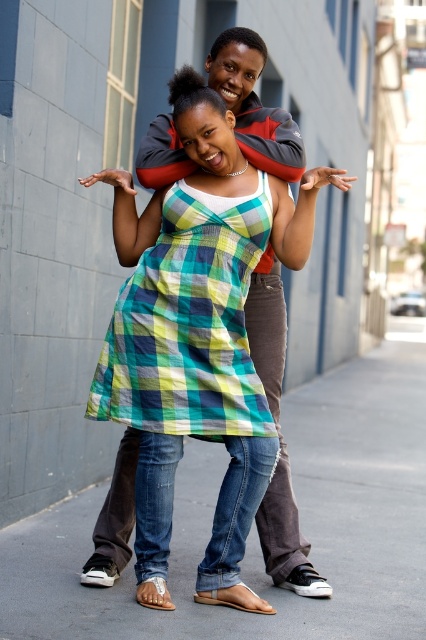
Which is more to the right, smooth concrete pavement at center or plaid fabric dress at center?

smooth concrete pavement at center

Between smooth concrete pavement at center and plaid fabric dress at center, which one appears on the left side from the viewer's perspective?

From the viewer's perspective, plaid fabric dress at center appears more on the left side.

In order to click on smooth concrete pavement at center in this screenshot , I will do `click(253, 532)`.

At what (x,y) coordinates should I click in order to perform the action: click on smooth concrete pavement at center. Please return your answer as a coordinate pair (x, y). The height and width of the screenshot is (640, 426). Looking at the image, I should click on (253, 532).

This screenshot has width=426, height=640. What do you see at coordinates (253, 532) in the screenshot?
I see `smooth concrete pavement at center` at bounding box center [253, 532].

From the picture: Is smooth concrete pavement at center to the right of green plaid dress at center from the viewer's perspective?

Correct, you'll find smooth concrete pavement at center to the right of green plaid dress at center.

Is point (322, 445) farther from viewer compared to point (166, 419)?

Yes, point (322, 445) is behind point (166, 419).

At what (x,y) coordinates should I click in order to perform the action: click on smooth concrete pavement at center. Please return your answer as a coordinate pair (x, y). This screenshot has width=426, height=640. Looking at the image, I should click on (253, 532).

From the picture: Who is shorter, green plaid dress at center or plaid fabric dress at center?

green plaid dress at center is shorter.

Between point (178, 348) and point (207, 131), which one is positioned in front?

Point (207, 131)

What do you see at coordinates (187, 324) in the screenshot? This screenshot has height=640, width=426. I see `green plaid dress at center` at bounding box center [187, 324].

Image resolution: width=426 pixels, height=640 pixels. Identify the location of green plaid dress at center. (187, 324).